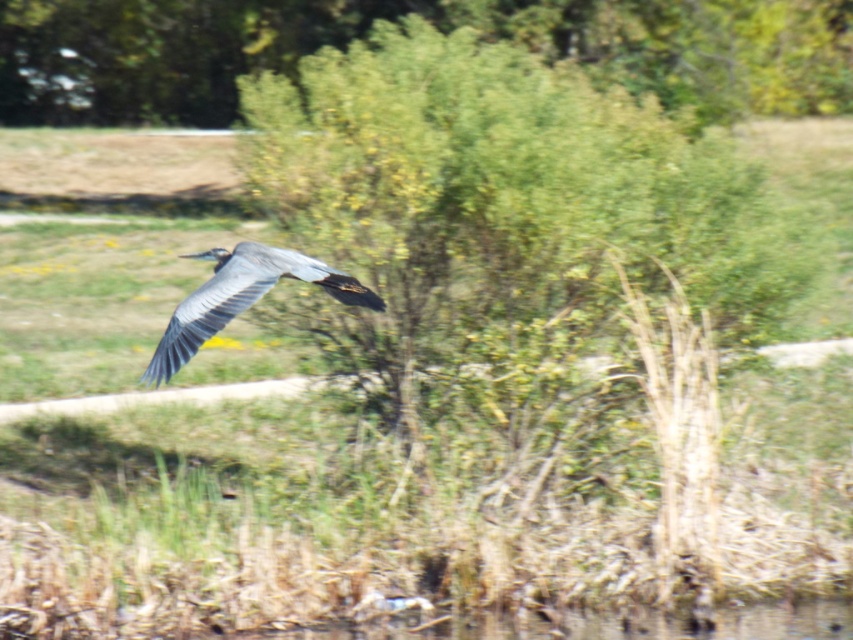
Question: Can you confirm if green leafy tree at upper center is smaller than gray matte bird at center?

Choices:
 (A) yes
 (B) no

Answer: (B)

Question: Can you confirm if green leafy tree at upper center is smaller than gray matte bird at center?

Choices:
 (A) no
 (B) yes

Answer: (A)

Question: Does green leafy tree at upper center have a larger size compared to gray matte bird at center?

Choices:
 (A) no
 (B) yes

Answer: (B)